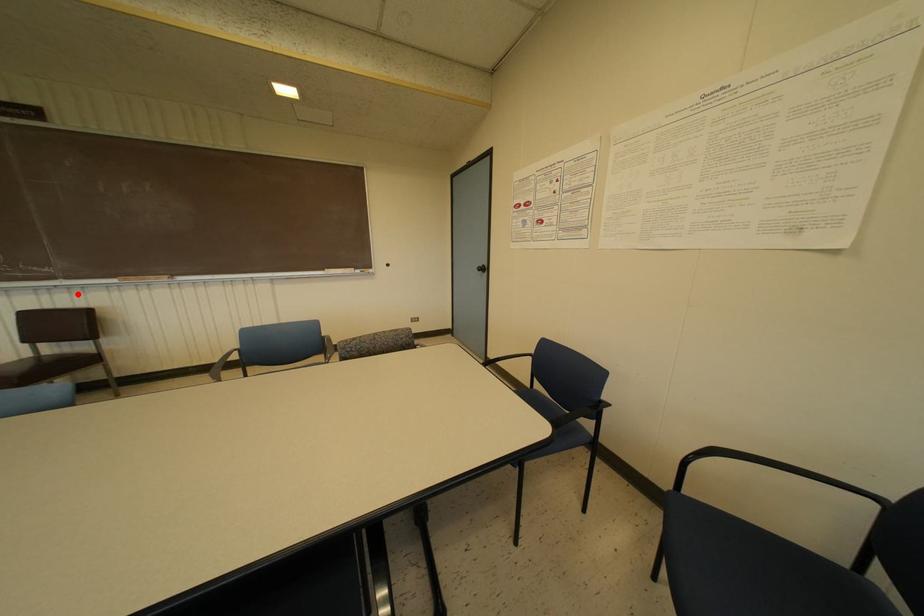
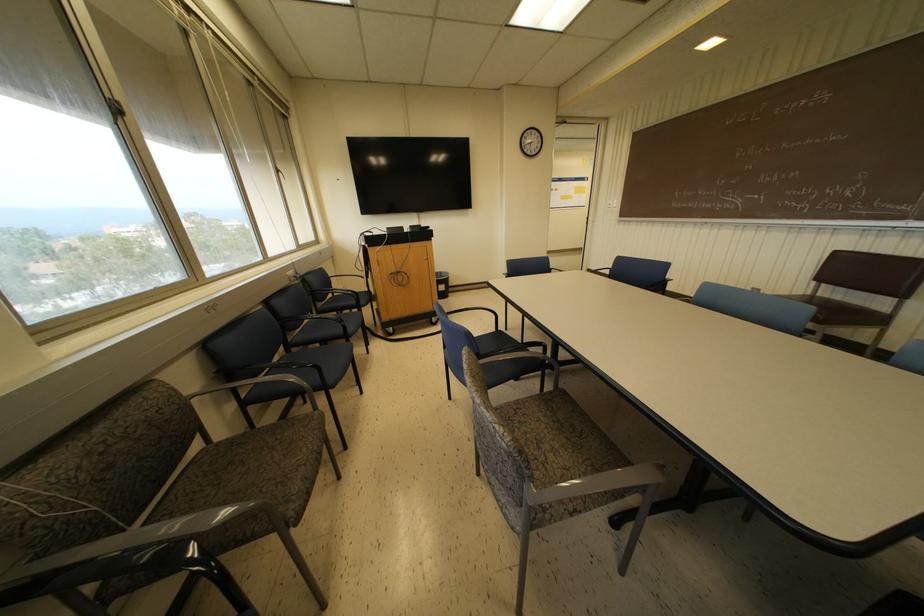
In the second image, find the point that corresponds to the highlighted location in the first image.

(914, 240)